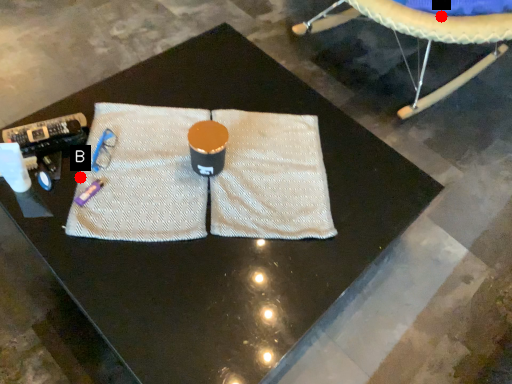
Question: Two points are circled on the image, labeled by A and B beside each circle. Which point is farther to the camera?

Choices:
 (A) A is further
 (B) B is further

Answer: (A)